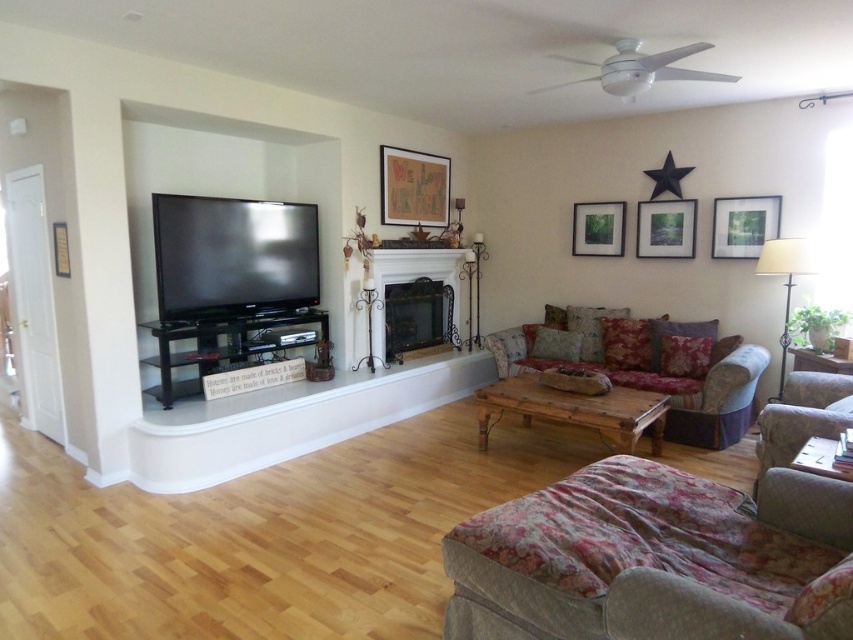
Question: Estimate the real-world distances between objects in this image. Which object is closer to the wooden framed map at upper center?

Choices:
 (A) matte wooden picture frame at upper right
 (B) black wrought iron fireplace at center
 (C) matte white picture frame at upper right

Answer: (B)

Question: Can you confirm if wooden framed map at upper center is positioned above matte white picture frame at upper right?

Choices:
 (A) no
 (B) yes

Answer: (B)

Question: Among these points, which one is farthest from the camera?

Choices:
 (A) (740, 221)
 (B) (399, 211)

Answer: (B)

Question: Can you confirm if wooden framed map at upper center is thinner than black wrought iron fireplace at center?

Choices:
 (A) yes
 (B) no

Answer: (A)

Question: Is floral fabric ottoman at lower right smaller than matte wooden picture frame at upper center?

Choices:
 (A) no
 (B) yes

Answer: (A)

Question: Which of the following is the closest to the observer?

Choices:
 (A) (392, 193)
 (B) (595, 225)

Answer: (A)